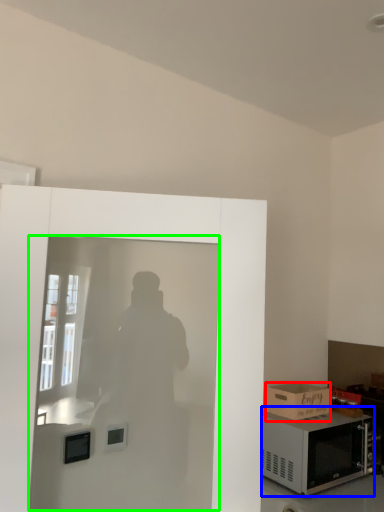
Question: Based on their relative distances, which object is farther from box (highlighted by a red box)? Choose from microwave oven (highlighted by a blue box) and screen door (highlighted by a green box).

Choices:
 (A) microwave oven
 (B) screen door

Answer: (B)